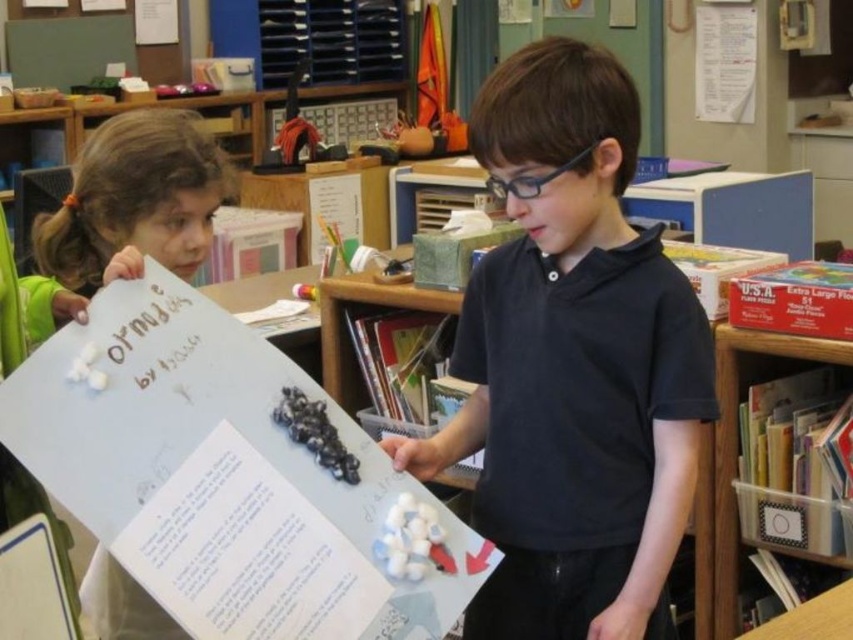
You are a teacher in the classroom. You need to retrieve the clear plastic bin at lower right to collect some materials. However, the black matte shirt at center is blocking your path. Can you move around it to reach the bin?

The black matte shirt at center is above the clear plastic bin at lower right, so you can move around it to reach the bin since it is positioned higher up and does not block the path directly below.

You are a teacher in the classroom and need to store the materials used in the presentation. The black matte shirt at center and the clear plastic bin at lower right are both in the room. Which object is bigger and can hold more items?

The black matte shirt at center has a larger size compared to the clear plastic bin at lower right, so it can hold more items.